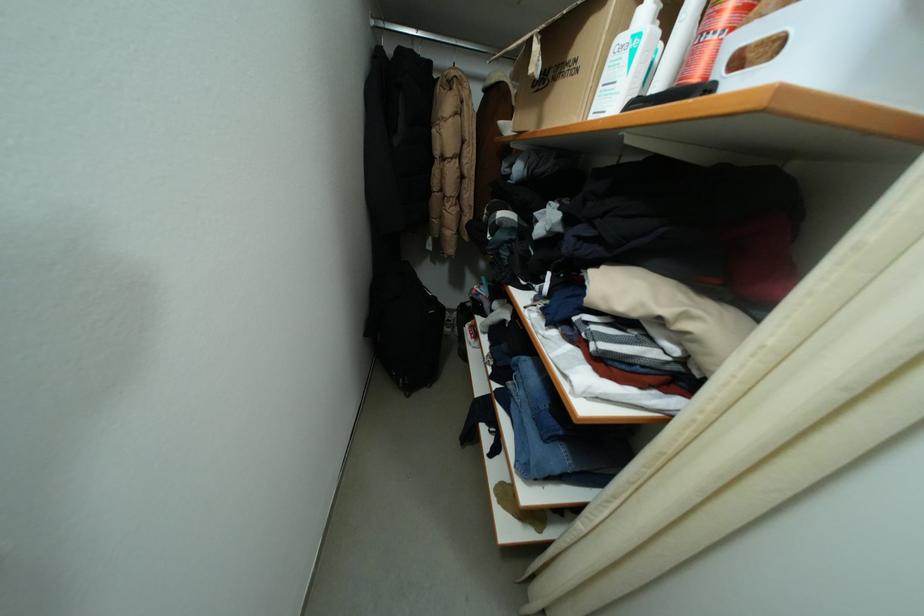
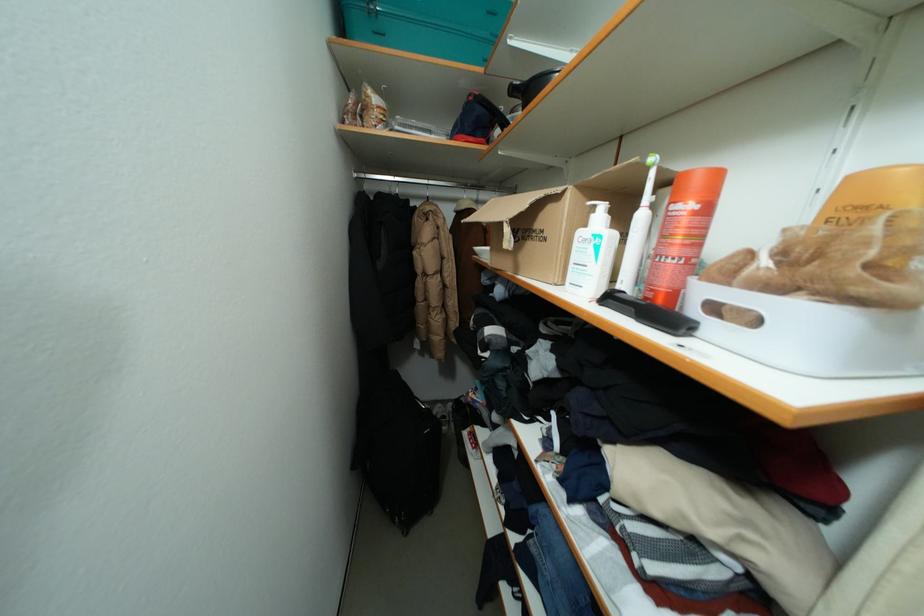
Find the pixel in the second image that matches point 585,74 in the first image.

(553, 243)